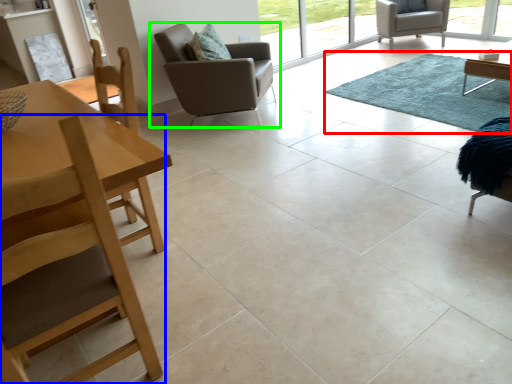
Question: Considering the real-world distances, which object is farthest from mat (highlighted by a red box)? chair (highlighted by a blue box) or chair (highlighted by a green box)?

Choices:
 (A) chair
 (B) chair

Answer: (A)